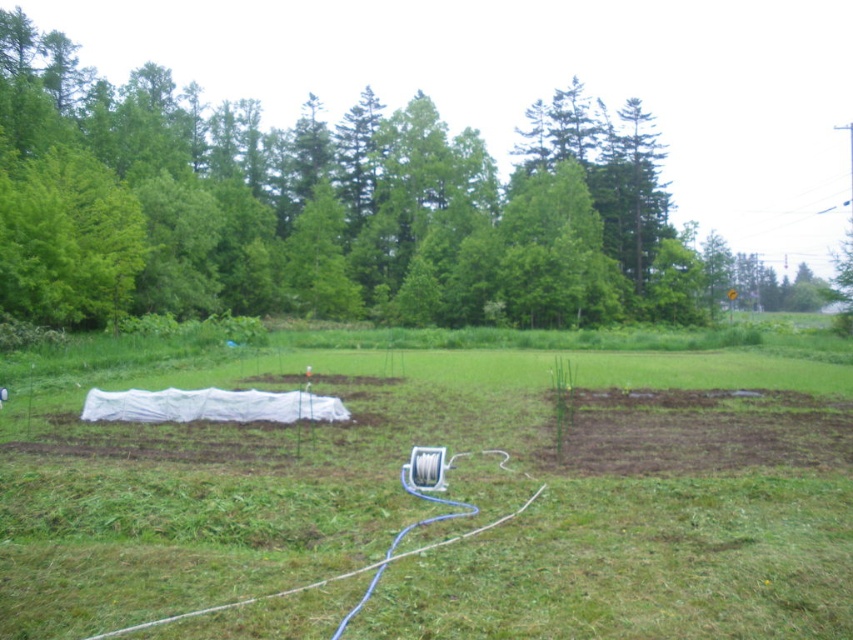
Which of these two, white fabric at center or green leafy tree at upper center, stands taller?

green leafy tree at upper center

In the scene shown: Does white fabric at center lie behind green leafy tree at upper center?

No.

Is point (254, 637) closer to camera compared to point (761, 152)?

Yes, it is in front of point (761, 152).

Image resolution: width=853 pixels, height=640 pixels. I want to click on white fabric at center, so click(447, 496).